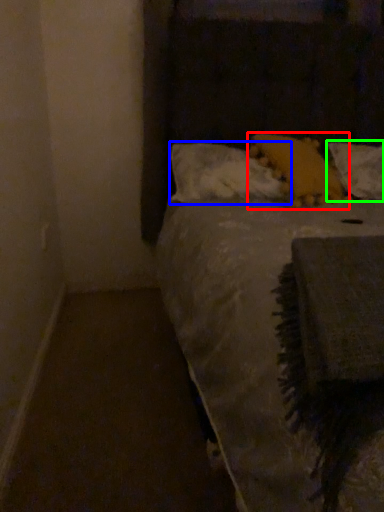
Question: Which object is the farthest from pillow (highlighted by a red box)? Choose among these: pillow (highlighted by a blue box) or pillow (highlighted by a green box).

Choices:
 (A) pillow
 (B) pillow

Answer: (B)